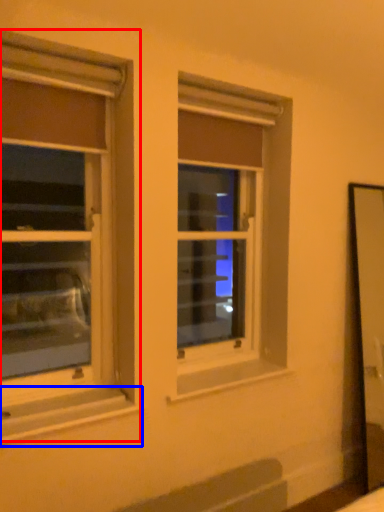
Question: Which of the following is the closest to the observer, window (highlighted by a red box) or window sill (highlighted by a blue box)?

Choices:
 (A) window
 (B) window sill

Answer: (B)